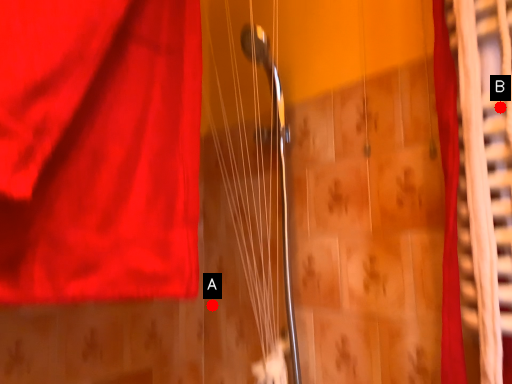
Question: Two points are circled on the image, labeled by A and B beside each circle. Which point is farther from the camera taking this photo?

Choices:
 (A) A is further
 (B) B is further

Answer: (A)